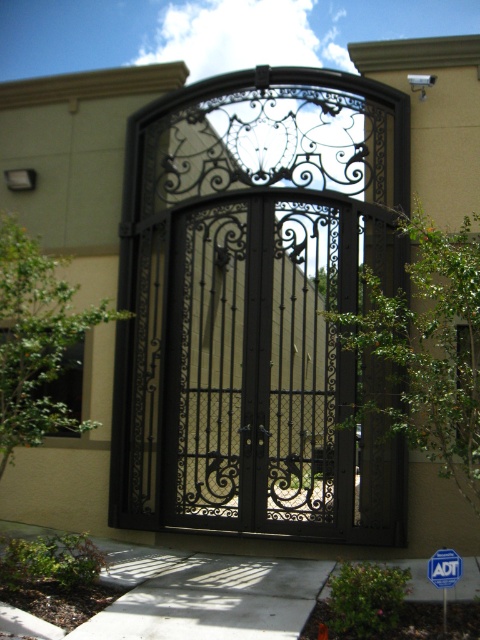
Between black wrought iron gate at center and blue plastic sign at lower right, which one is positioned lower?

blue plastic sign at lower right is below.

Can you confirm if black wrought iron gate at center is positioned below blue plastic sign at lower right?

No, black wrought iron gate at center is not below blue plastic sign at lower right.

Describe the element at coordinates (256, 307) in the screenshot. I see `black wrought iron gate at center` at that location.

Locate an element on the screen. black wrought iron gate at center is located at coordinates (256, 307).